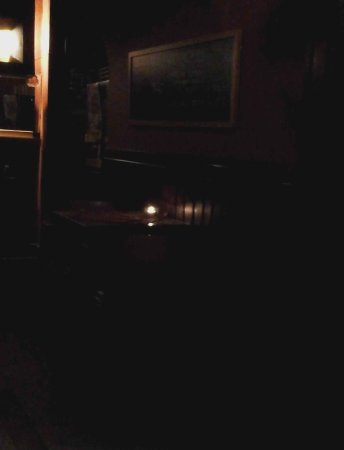
Identify the location of chair. (x=203, y=203).